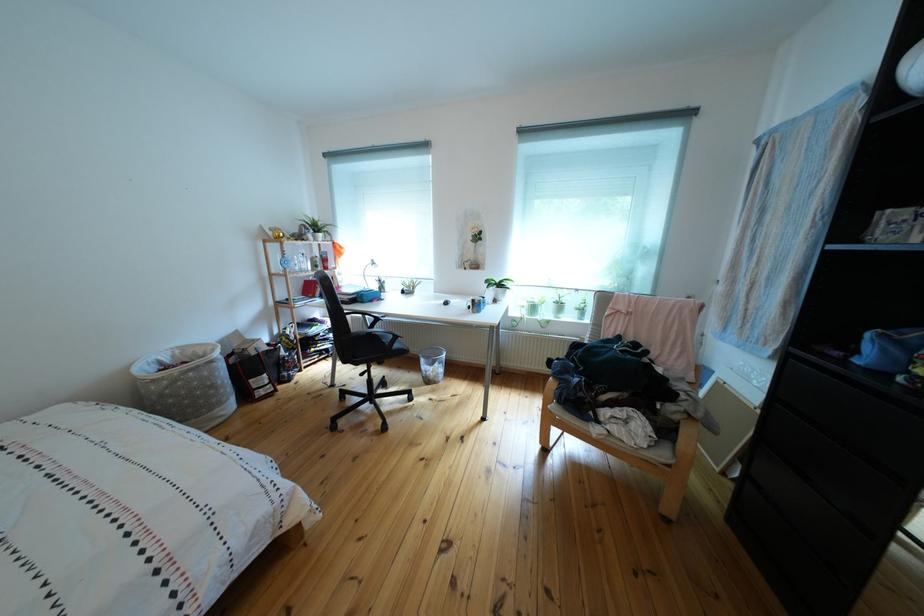
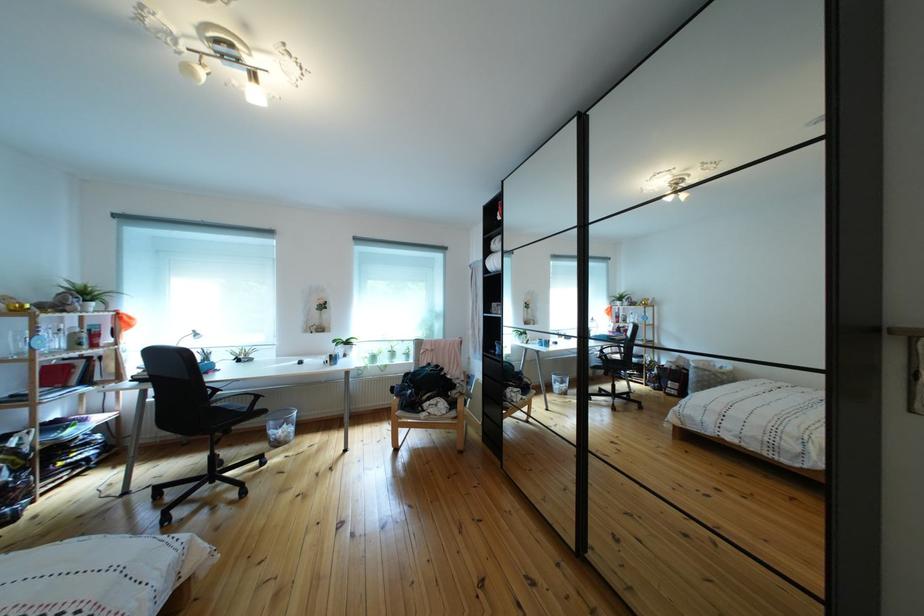
In the second image, find the point that corresponds to (433,367) in the first image.

(283, 430)